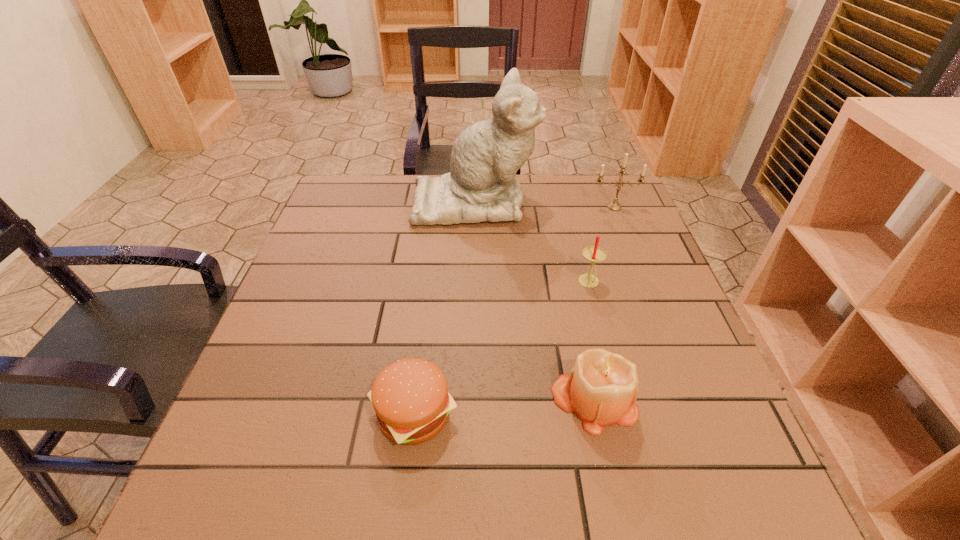
The width and height of the screenshot is (960, 540). In order to click on cat in this screenshot , I will do `click(481, 186)`.

Identify the location of the rightmost object. (614, 206).

Where is `the rightmost candle`? The width and height of the screenshot is (960, 540). the rightmost candle is located at coordinates (614, 206).

In order to click on the nearest candle in this screenshot , I will do `click(602, 389)`.

Locate an element on the screen. the third nearest object is located at coordinates (594, 254).

At what (x,y) coordinates should I click in order to perform the action: click on the shortest object. Please return your answer as a coordinate pair (x, y). Image resolution: width=960 pixels, height=540 pixels. Looking at the image, I should click on (410, 397).

The image size is (960, 540). Find the location of `free spot located 0.050m on the front-facing side of the cat`. free spot located 0.050m on the front-facing side of the cat is located at coordinates (554, 201).

Identify the location of vacant space situated on the left of the farthest candle. Image resolution: width=960 pixels, height=540 pixels. (528, 207).

Locate an element on the screen. free region located on the left of the nearest candle is located at coordinates (x=383, y=400).

The height and width of the screenshot is (540, 960). What are the coordinates of `vacant space situated 0.130m on the right of the third nearest object` in the screenshot? It's located at (656, 283).